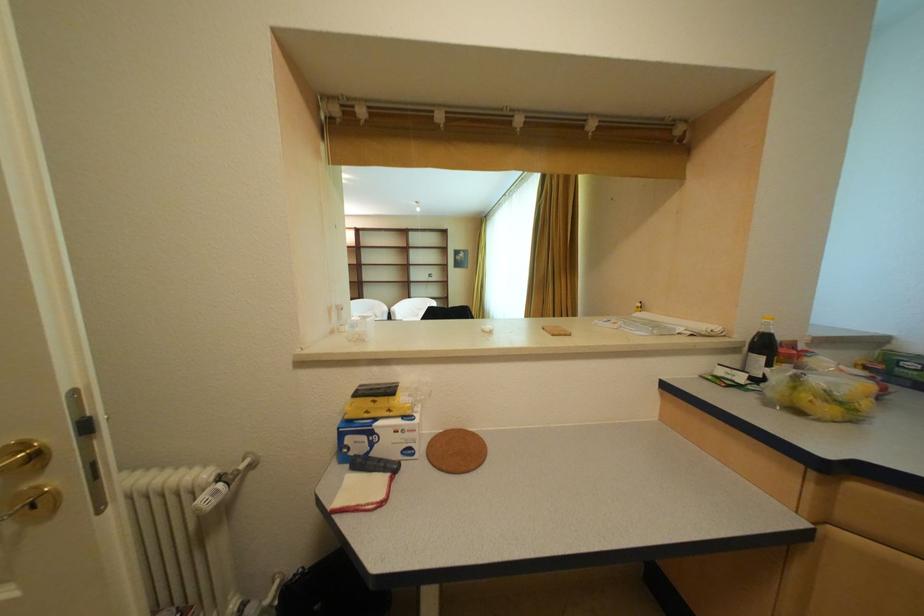
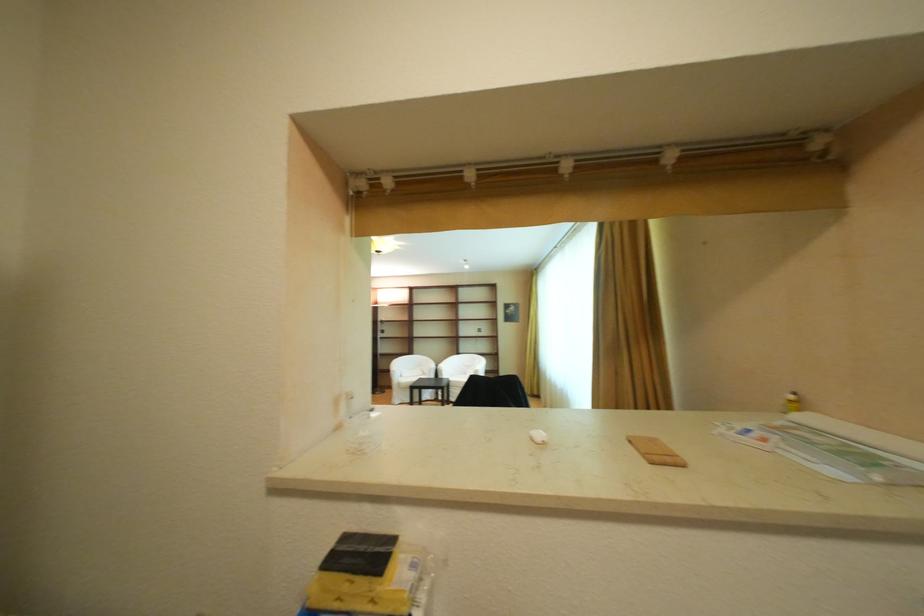
Question: The camera is either moving clockwise (left) or counter-clockwise (right) around the object. The first image is from the beginning of the video and the second image is from the end. Is the camera moving left or right when shooting the video?

Choices:
 (A) Left
 (B) Right

Answer: (B)